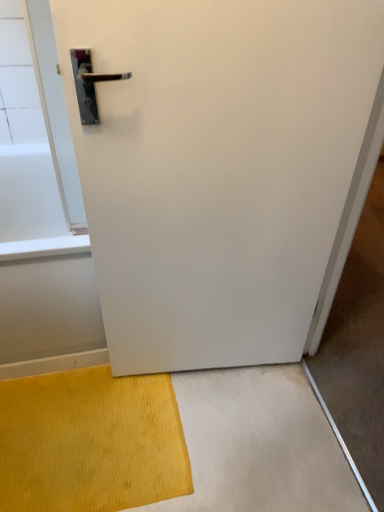
Measure the distance between point [50,376] and camera.

The distance of point [50,376] from camera is 1.52 meters.

What do you see at coordinates (90, 442) in the screenshot?
I see `yellow textured mat at lower left` at bounding box center [90, 442].

Identify the location of yellow textured mat at lower left. This screenshot has width=384, height=512. (90, 442).

Image resolution: width=384 pixels, height=512 pixels. Describe the element at coordinates (223, 170) in the screenshot. I see `white matte door at center` at that location.

Locate an element on the screen. white matte door at center is located at coordinates (223, 170).

Locate an element on the screen. The image size is (384, 512). yellow textured mat at lower left is located at coordinates (90, 442).

Is white matte door at center at the right side of yellow textured mat at lower left?

Yes.

Relative to yellow textured mat at lower left, is white matte door at center in front or behind?

white matte door at center is in front of yellow textured mat at lower left.

Considering the points (379, 58) and (54, 490), which point is behind, point (379, 58) or point (54, 490)?

The point (54, 490) is behind.

From the picture: From the image's perspective, is white matte door at center above or below yellow textured mat at lower left?

white matte door at center is above yellow textured mat at lower left.

Looking at this image, from a real-world perspective, which object rests below the other?

yellow textured mat at lower left is physically lower.

Can you confirm if white matte door at center is thinner than yellow textured mat at lower left?

Yes, white matte door at center is thinner than yellow textured mat at lower left.

Is white matte door at center taller or shorter than yellow textured mat at lower left?

Considering their sizes, white matte door at center has more height than yellow textured mat at lower left.

Which of these two, white matte door at center or yellow textured mat at lower left, is smaller?

yellow textured mat at lower left is smaller.

Is yellow textured mat at lower left a part of white matte door at center?

Definitely not — yellow textured mat at lower left is not inside white matte door at center.

Can you see white matte door at center touching yellow textured mat at lower left?

No.

Is white matte door at center oriented away from yellow textured mat at lower left?

No.

You are a GUI agent. You are given a task and a screenshot of the screen. Output one action in this format:
    pyautogui.click(x=<x>, y=<y>)
    Task: Click on the doormat behind the white matte door at center
    The height and width of the screenshot is (512, 384).
    Given the screenshot: What is the action you would take?
    pyautogui.click(x=90, y=442)

Does yellow textured mat at lower left appear on the right side of white matte door at center?

No, yellow textured mat at lower left is not to the right of white matte door at center.

Considering the positions of objects yellow textured mat at lower left and white matte door at center in the image provided, who is behind, yellow textured mat at lower left or white matte door at center?

yellow textured mat at lower left is further away from the camera.

Does point (54, 432) come closer to viewer compared to point (173, 56)?

No.

From the image's perspective, is yellow textured mat at lower left beneath white matte door at center?

Indeed, from the image's perspective, yellow textured mat at lower left is shown beneath white matte door at center.

From a real-world perspective, is yellow textured mat at lower left located higher than white matte door at center?

Incorrect, from a real-world perspective, yellow textured mat at lower left is lower than white matte door at center.

Can you confirm if yellow textured mat at lower left is thinner than white matte door at center?

Incorrect, the width of yellow textured mat at lower left is not less than that of white matte door at center.

Between yellow textured mat at lower left and white matte door at center, which one has less height?

yellow textured mat at lower left is shorter.

Does yellow textured mat at lower left have a larger size compared to white matte door at center?

No.

Is yellow textured mat at lower left situated inside white matte door at center or outside?

yellow textured mat at lower left is located beyond the bounds of white matte door at center.

Is yellow textured mat at lower left in contact with white matte door at center?

No, yellow textured mat at lower left is not next to white matte door at center.

Could you tell me if yellow textured mat at lower left is turned towards white matte door at center?

No, yellow textured mat at lower left is not facing towards white matte door at center.

What's the angular difference between yellow textured mat at lower left and white matte door at center's facing directions?

yellow textured mat at lower left and white matte door at center are facing 6.32 degrees away from each other.

This screenshot has width=384, height=512. Find the location of `doormat located on the left of white matte door at center`. doormat located on the left of white matte door at center is located at coordinates (90, 442).

The image size is (384, 512). Find the location of `door to the right of yellow textured mat at lower left`. door to the right of yellow textured mat at lower left is located at coordinates (223, 170).

At what (x,y) coordinates should I click in order to perform the action: click on doormat below the white matte door at center (from the image's perspective). Please return your answer as a coordinate pair (x, y). Image resolution: width=384 pixels, height=512 pixels. Looking at the image, I should click on (90, 442).